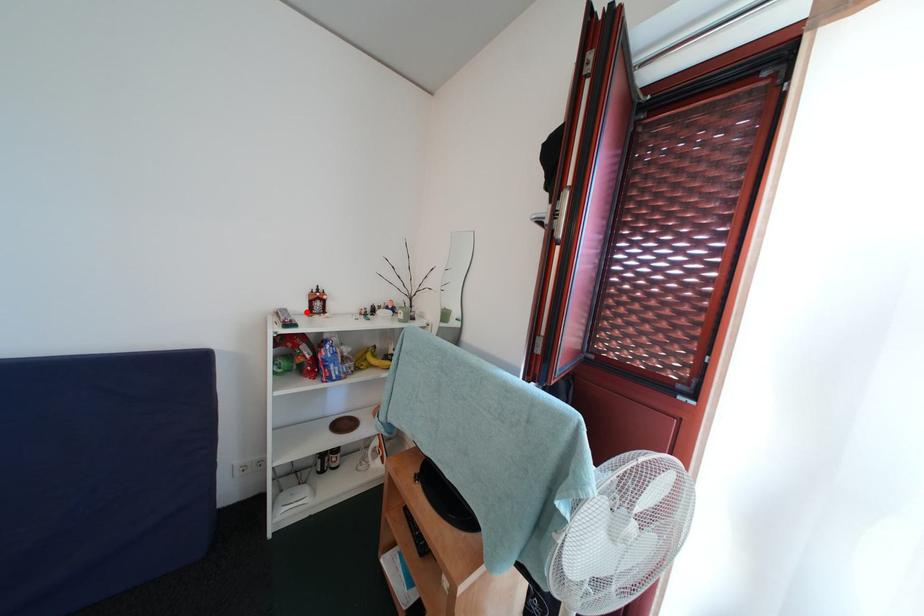
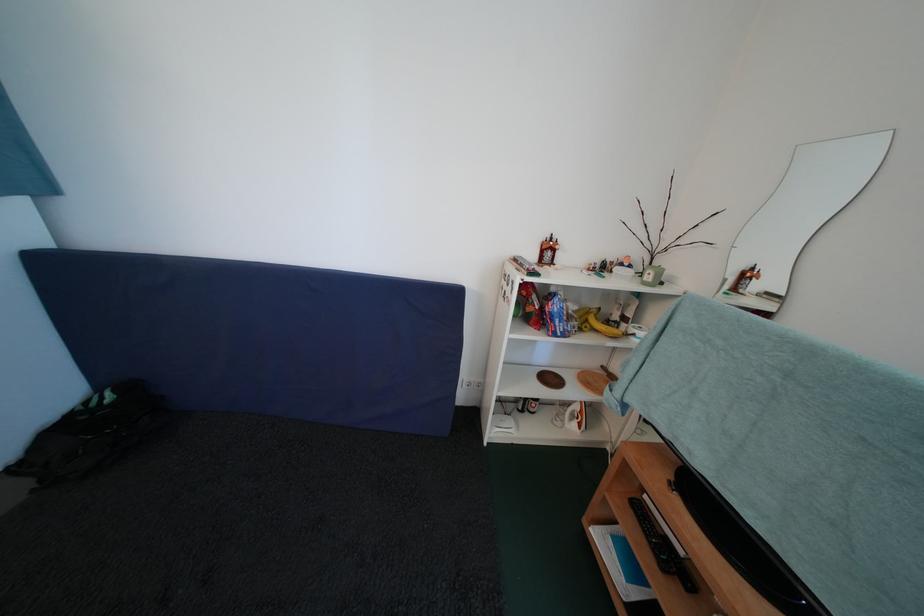
In the second image, find the point that corresponds to the highlighted location in the first image.

(539, 261)